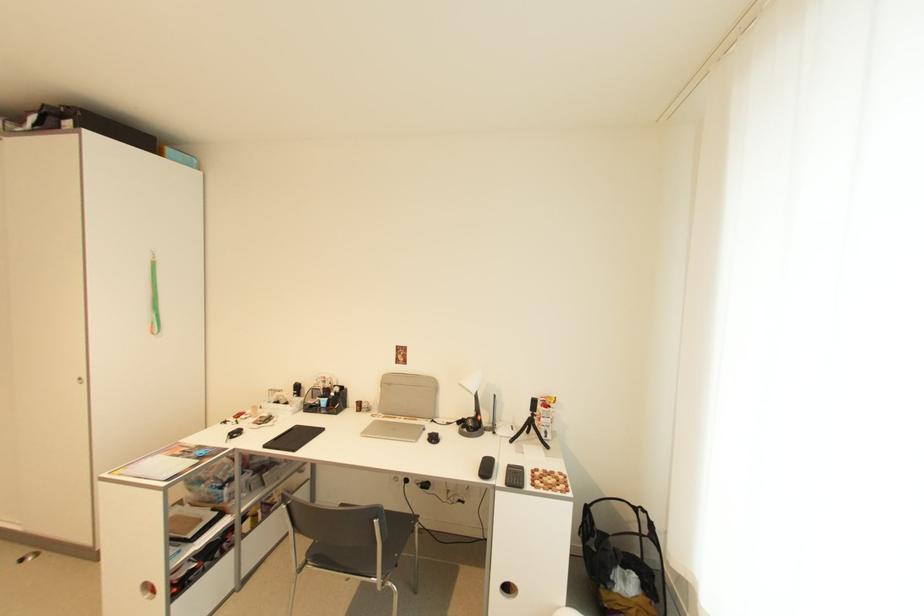
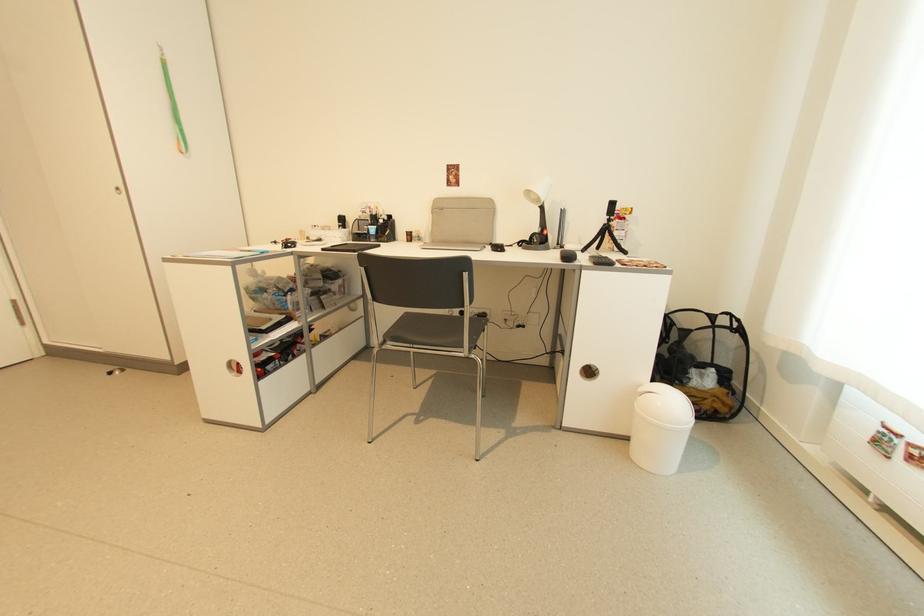
Looking at this image, which direction would the cameraman need to move to produce the second image?

The cameraman walked toward left, forward.